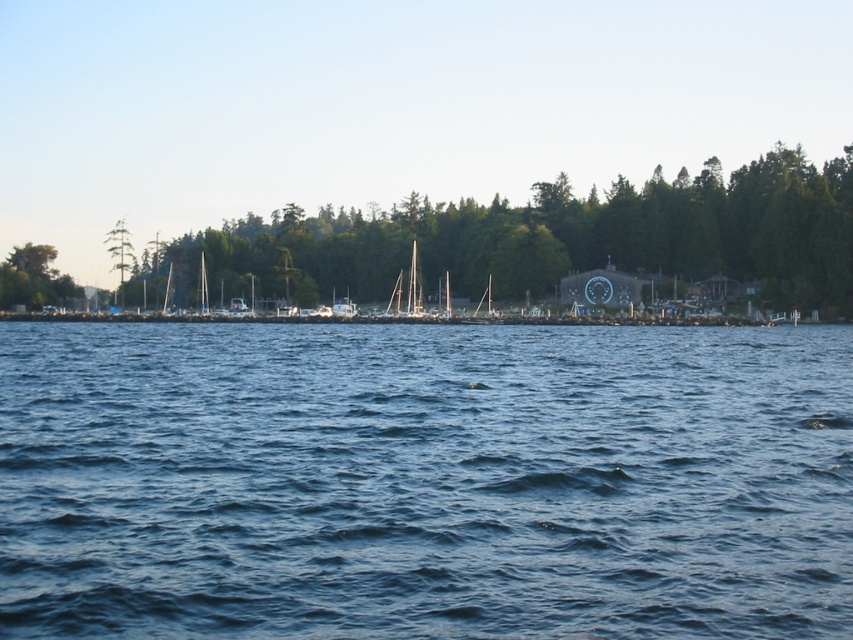
You are standing on the pier and see the blue water at center and the white matte sailboat at center. Which object is positioned to the right of the other?

The blue water at center is to the right of the white matte sailboat at center.

You are standing at the edge of the waterfront scene. You see two points marked on the image. The first point is at coordinate point(347, 480) and the second is at point(735, 253). Which point is closer to you?

Point(347, 480) is in front of point(735, 253), so it is closer to you.